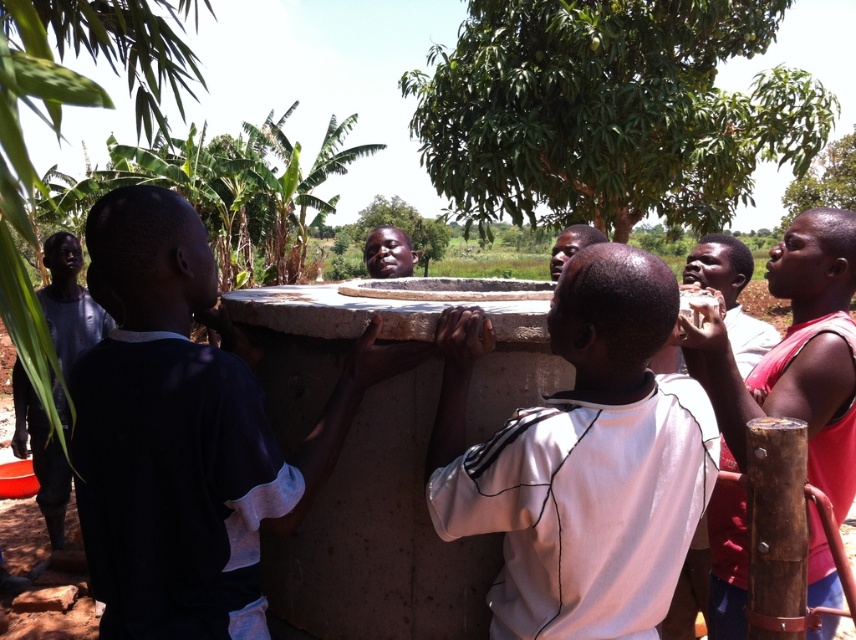
Question: Can you confirm if white matte shirt at center is positioned below smooth skin face at center?

Choices:
 (A) yes
 (B) no

Answer: (A)

Question: Considering the relative positions of wooden hand pump at right and smooth skin face at center in the image provided, where is wooden hand pump at right located with respect to smooth skin face at center?

Choices:
 (A) left
 (B) right

Answer: (A)

Question: Among these points, which one is farthest from the camera?

Choices:
 (A) (553, 248)
 (B) (804, 221)
 (C) (381, 269)
 (D) (568, 266)

Answer: (C)

Question: Which is farther from the dark blue shirt at left?

Choices:
 (A) wooden hand pump at right
 (B) matte black head at center
 (C) white matte shirt at center

Answer: (B)

Question: Can you confirm if wooden hand pump at right is wider than matte black head at center?

Choices:
 (A) no
 (B) yes

Answer: (B)

Question: Among these points, which one is farthest from the camera?

Choices:
 (A) coord(806,356)
 (B) coord(562,237)
 (C) coord(574,362)

Answer: (B)